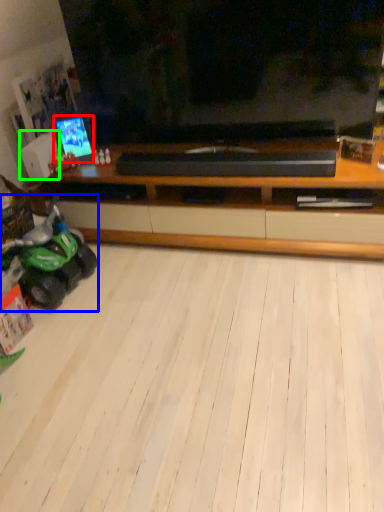
Question: Estimate the real-world distances between objects in this image. Which object is closer to tv show (highlighted by a red box), land vehicle (highlighted by a blue box) or speaker (highlighted by a green box)?

Choices:
 (A) land vehicle
 (B) speaker

Answer: (B)